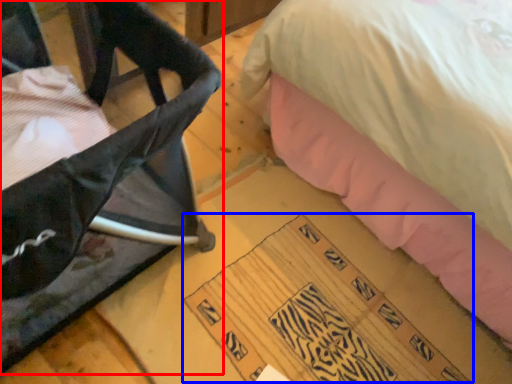
Question: Which object is further to the camera taking this photo, furniture (highlighted by a red box) or writing (highlighted by a blue box)?

Choices:
 (A) furniture
 (B) writing

Answer: (B)